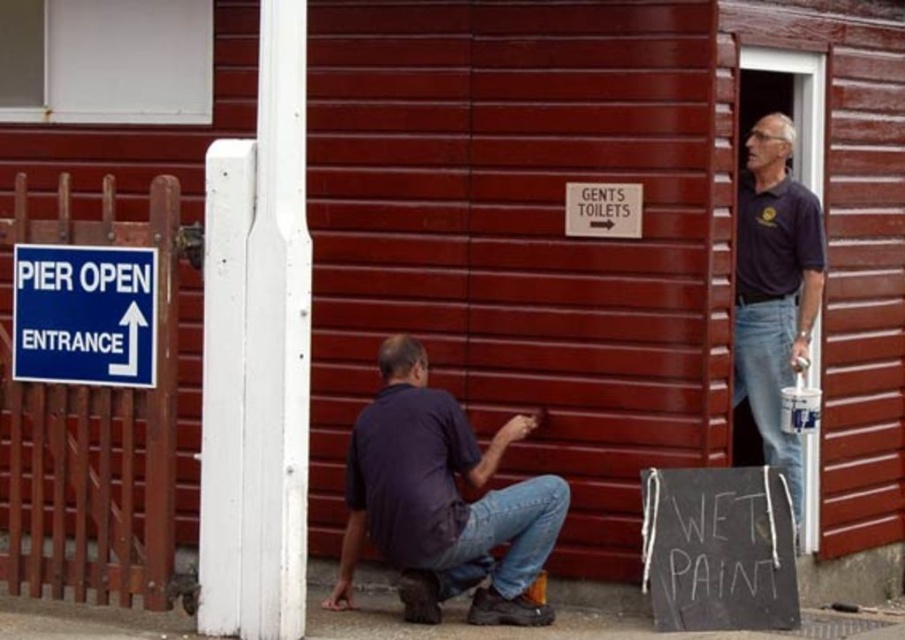
Who is positioned more to the left, matte dark blue shirt at center or blue plastic sign at upper left?

From the viewer's perspective, blue plastic sign at upper left appears more on the left side.

Who is positioned more to the right, matte dark blue shirt at center or blue plastic sign at upper left?

From the viewer's perspective, matte dark blue shirt at center appears more on the right side.

Measure the distance between point (519, 595) and camera.

Point (519, 595) and camera are 5.92 meters apart.

You are a GUI agent. You are given a task and a screenshot of the screen. Output one action in this format:
    pyautogui.click(x=<x>, y=<y>)
    Task: Click on the matte dark blue shirt at center
    This screenshot has height=640, width=905.
    Given the screenshot: What is the action you would take?
    pyautogui.click(x=443, y=500)

Does matte dark blue shirt at center have a lesser height compared to dark blue shirt at upper right?

Yes.

Is point (501, 444) positioned in front of point (818, 252)?

Yes, point (501, 444) is closer to viewer.

Where is `matte dark blue shirt at center`? This screenshot has width=905, height=640. matte dark blue shirt at center is located at coordinates (443, 500).

Can you confirm if dark blue shirt at upper right is positioned above blue plastic sign at upper left?

Actually, dark blue shirt at upper right is below blue plastic sign at upper left.

Locate an element on the screen. dark blue shirt at upper right is located at coordinates (774, 291).

Locate an element on the screen. dark blue shirt at upper right is located at coordinates (774, 291).